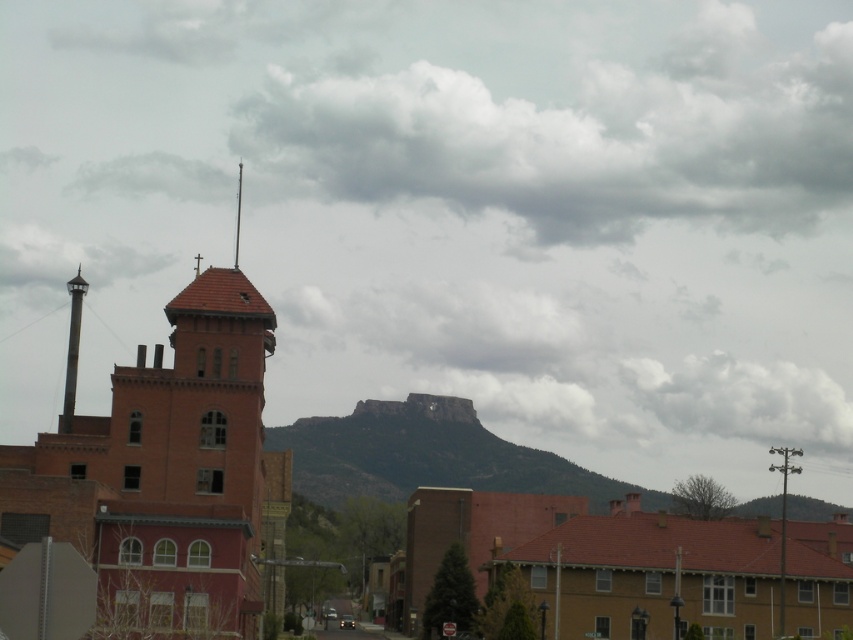
You are standing in a village surrounded by buildings with reddish brick facades. You see a rocky brown mountain at center and a cloudy gray cloud at upper center. Which object is closer to you?

The rocky brown mountain at center is closer to you because it is in front of the cloudy gray cloud at upper center.

You are a drone operator trying to capture a photo of the cloudy gray cloud at upper center and the white fluffy cloud at upper center. The camera on your drone has a maximum range of 100 meters. Can you capture both clouds in a single photo without moving the drone?

The cloudy gray cloud at upper center is 117.67 meters from the white fluffy cloud at upper center. Since the distance exceeds the camera range of 100 meters, you cannot capture both clouds in a single photo without moving the drone.